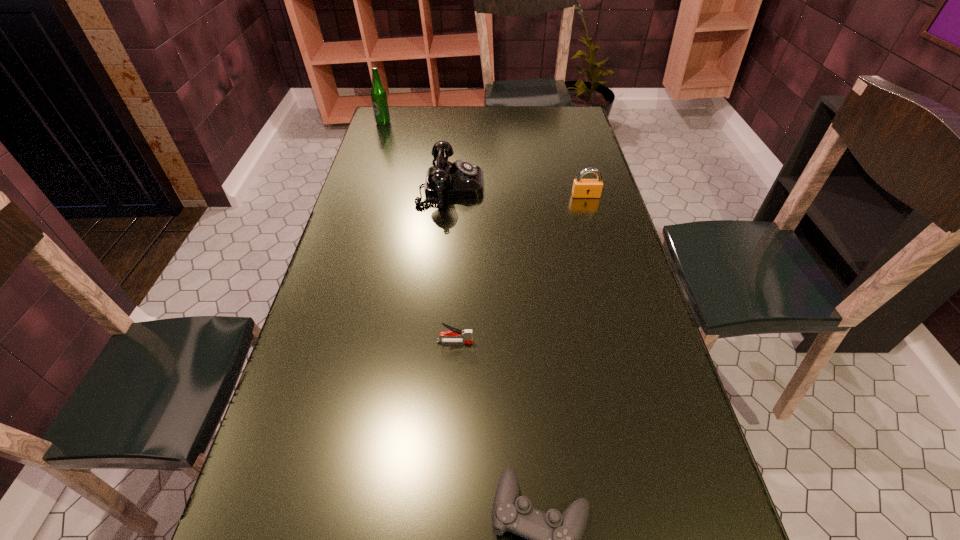
In order to click on empty space between the fourth shortest object and the stapler in this screenshot , I will do `click(453, 264)`.

Where is `unoccupied area between the second nearest object and the beer bottle`? This screenshot has height=540, width=960. unoccupied area between the second nearest object and the beer bottle is located at coordinates point(420,232).

You are a GUI agent. You are given a task and a screenshot of the screen. Output one action in this format:
    pyautogui.click(x=<x>, y=<y>)
    Task: Click on the vacant space that is in between the fourth farthest object and the farthest object
    
    Given the screenshot: What is the action you would take?
    [420, 232]

The image size is (960, 540). I want to click on empty space between the telephone and the third tallest object, so click(518, 191).

Identify the location of vacant space that is in between the padlock and the leftmost object. (485, 159).

The height and width of the screenshot is (540, 960). What are the coordinates of `free space between the fourth tallest object and the tallest object` in the screenshot? It's located at (420, 232).

Locate an element on the screen. The image size is (960, 540). object that is the third closest to the second object from right to left is located at coordinates (582, 188).

Select which object is the third closest to the farthest object. Please provide its 2D coordinates. Your answer should be formatted as a tuple, i.e. [(x, y)], where the tuple contains the x and y coordinates of a point satisfying the conditions above.

[(466, 335)]